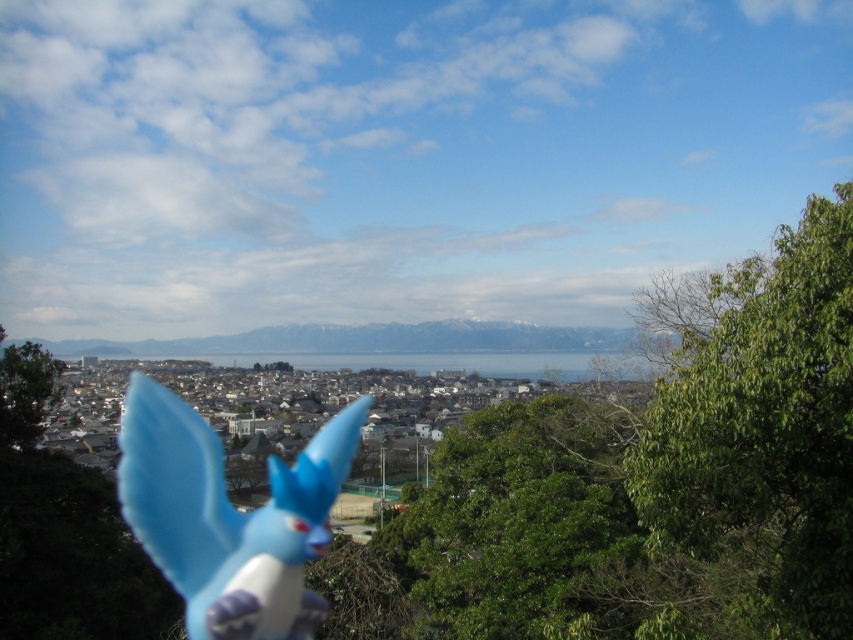
Between green leafy tree at right and matte plastic toy at center, which one has less height?

Standing shorter between the two is matte plastic toy at center.

Is point (790, 502) behind point (170, 483)?

No, (790, 502) is closer to viewer.

What do you see at coordinates (759, 420) in the screenshot?
I see `green leafy tree at right` at bounding box center [759, 420].

Find the location of a particular element. green leafy tree at right is located at coordinates (759, 420).

Can you confirm if green leafy tree at right is wider than green matte tree at lower left?

Correct, the width of green leafy tree at right exceeds that of green matte tree at lower left.

Is green leafy tree at right taller than green matte tree at lower left?

Yes, green leafy tree at right is taller than green matte tree at lower left.

At what (x,y) coordinates should I click in order to perform the action: click on green leafy tree at right. Please return your answer as a coordinate pair (x, y). The image size is (853, 640). Looking at the image, I should click on (759, 420).

Is matte plastic toy at center above green matte tree at lower left?

Incorrect, matte plastic toy at center is not positioned above green matte tree at lower left.

This screenshot has height=640, width=853. What do you see at coordinates (229, 516) in the screenshot?
I see `matte plastic toy at center` at bounding box center [229, 516].

The image size is (853, 640). Describe the element at coordinates (229, 516) in the screenshot. I see `matte plastic toy at center` at that location.

Locate an element on the screen. The image size is (853, 640). matte plastic toy at center is located at coordinates (229, 516).